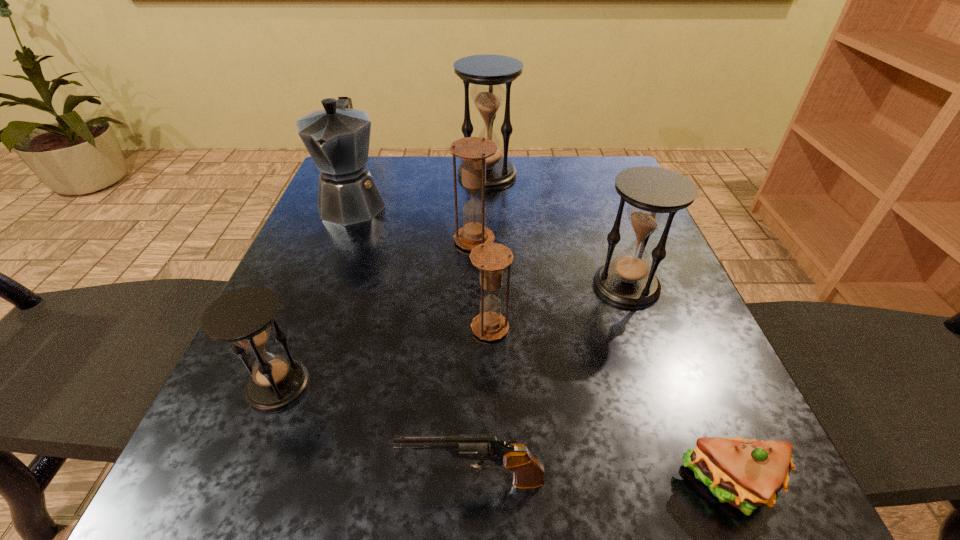
At what (x,y) coordinates should I click in order to perform the action: click on sandwich that is at the right edge. Please return your answer as a coordinate pair (x, y). The width and height of the screenshot is (960, 540). Looking at the image, I should click on (745, 473).

Where is `object that is at the far left corner`? This screenshot has width=960, height=540. object that is at the far left corner is located at coordinates (337, 138).

At what (x,y) coordinates should I click in order to perform the action: click on object that is at the near right corner. Please return your answer as a coordinate pair (x, y). This screenshot has height=540, width=960. Looking at the image, I should click on (745, 473).

Where is `vacant space at the far edge of the desktop`? vacant space at the far edge of the desktop is located at coordinates (457, 159).

Locate an element on the screen. The image size is (960, 540). free spot at the near edge of the desktop is located at coordinates (599, 459).

Locate an element on the screen. vacant space at the left edge of the desktop is located at coordinates (273, 433).

Identify the location of free space at the right edge. This screenshot has width=960, height=540. (641, 334).

Where is `vacant space at the near left corner of the desktop`? Image resolution: width=960 pixels, height=540 pixels. vacant space at the near left corner of the desktop is located at coordinates (219, 507).

Locate an element on the screen. This screenshot has height=540, width=960. free space at the far right corner of the desktop is located at coordinates (568, 187).

Find the location of a particular element. The height and width of the screenshot is (540, 960). empty space between the tallest hourglass and the coffeepot is located at coordinates (420, 188).